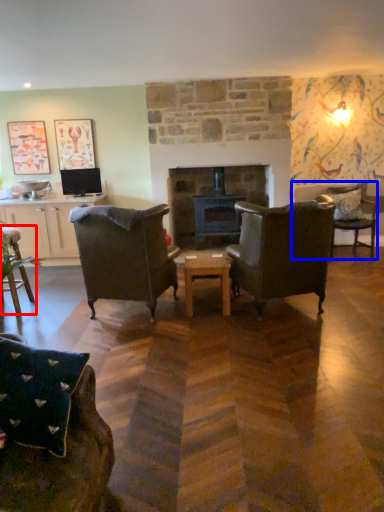
Question: Which object is further to the camera taking this photo, chair (highlighted by a red box) or chair (highlighted by a blue box)?

Choices:
 (A) chair
 (B) chair

Answer: (B)